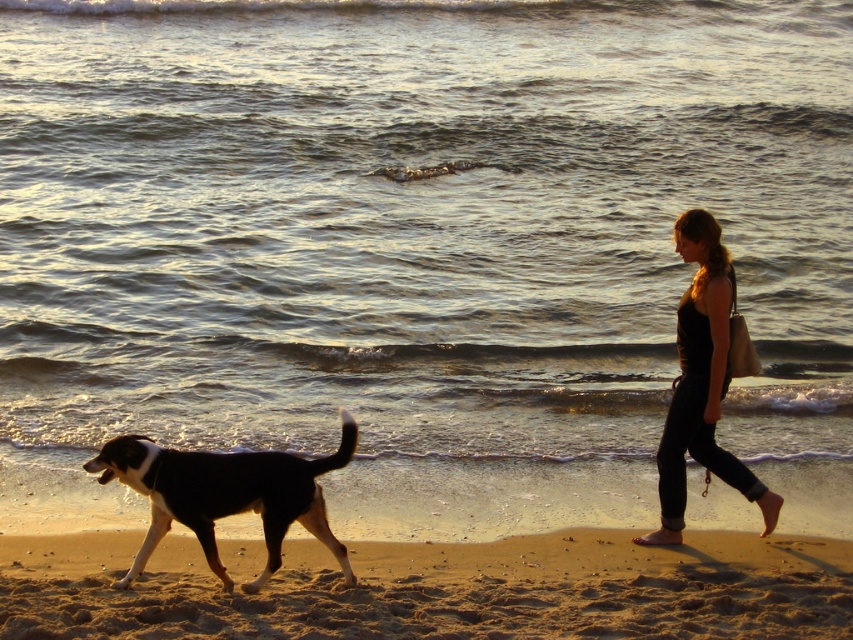
Question: Observing the image, what is the correct spatial positioning of sandy yellow sand at lower center in reference to black and white fur dog at lower left?

Choices:
 (A) left
 (B) right

Answer: (B)

Question: Does sandy yellow sand at lower center appear under black and white fur dog at lower left?

Choices:
 (A) yes
 (B) no

Answer: (A)

Question: Which point appears closest to the camera in this image?

Choices:
 (A) (161, 620)
 (B) (680, 230)
 (C) (181, 467)

Answer: (A)

Question: Can you confirm if black and white fur dog at lower left is positioned to the right of black cotton tank top at right?

Choices:
 (A) yes
 (B) no

Answer: (B)

Question: Among these objects, which one is nearest to the camera?

Choices:
 (A) black cotton tank top at right
 (B) sandy yellow sand at lower center
 (C) black and white fur dog at lower left

Answer: (B)

Question: Which of the following is the farthest from the observer?

Choices:
 (A) (395, 592)
 (B) (728, 342)

Answer: (B)